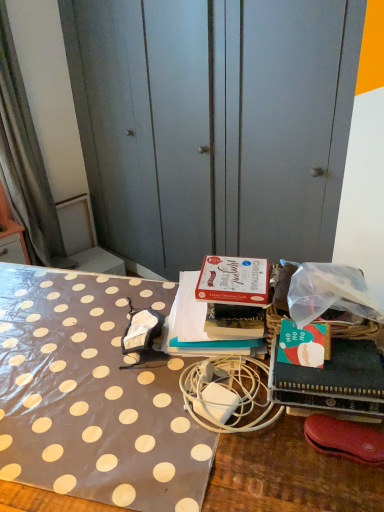
Where is `vacant area in front of green matte book at right, the 1th book positioned from the front`? The image size is (384, 512). vacant area in front of green matte book at right, the 1th book positioned from the front is located at coordinates (308, 478).